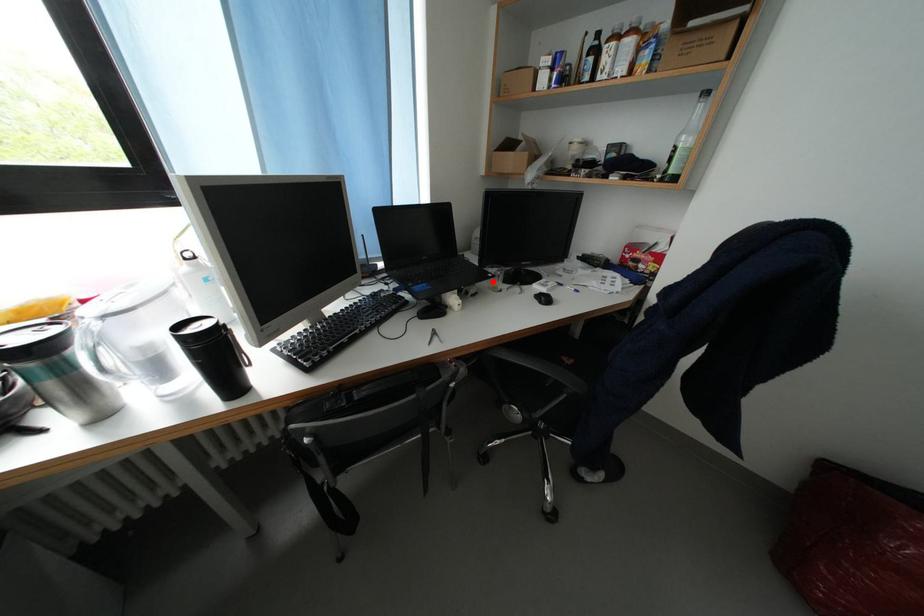
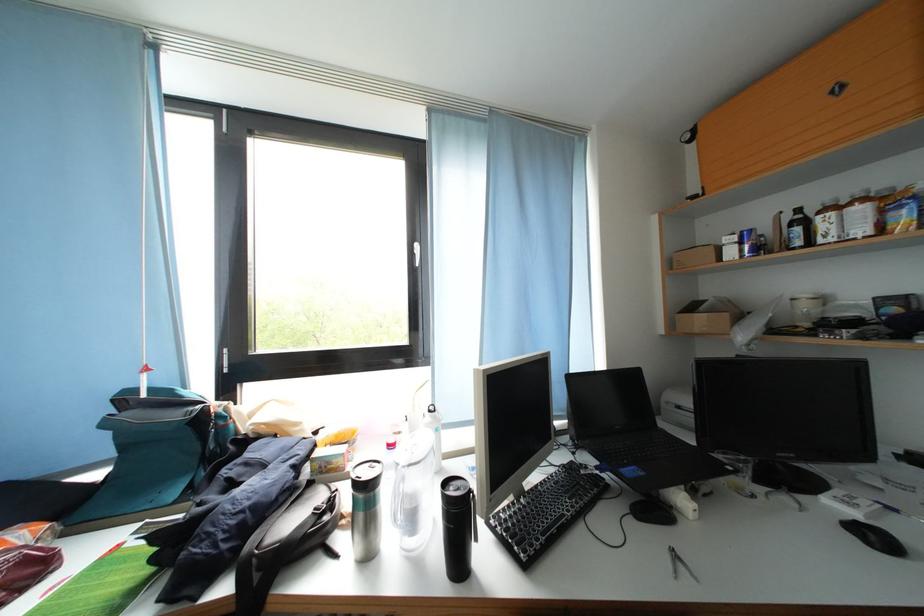
Find the pixel in the second image that matches the highlighted location in the first image.

(727, 474)